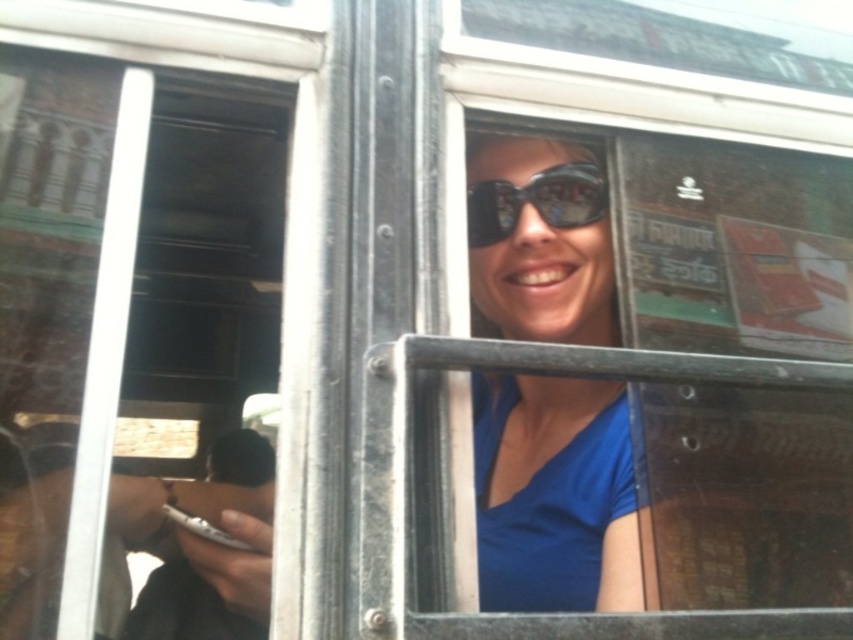
Is blue matte shirt at center to the left of black matte goggles at center from the viewer's perspective?

Incorrect, blue matte shirt at center is not on the left side of black matte goggles at center.

You are a GUI agent. You are given a task and a screenshot of the screen. Output one action in this format:
    pyautogui.click(x=<x>, y=<y>)
    Task: Click on the blue matte shirt at center
    
    Given the screenshot: What is the action you would take?
    pyautogui.click(x=554, y=493)

Where is `blue matte shirt at center`? This screenshot has height=640, width=853. blue matte shirt at center is located at coordinates (554, 493).